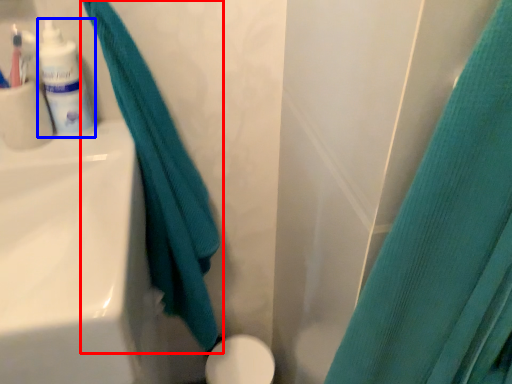
Question: Among these objects, which one is farthest to the camera, curtain (highlighted by a red box) or toiletry (highlighted by a blue box)?

Choices:
 (A) curtain
 (B) toiletry

Answer: (B)